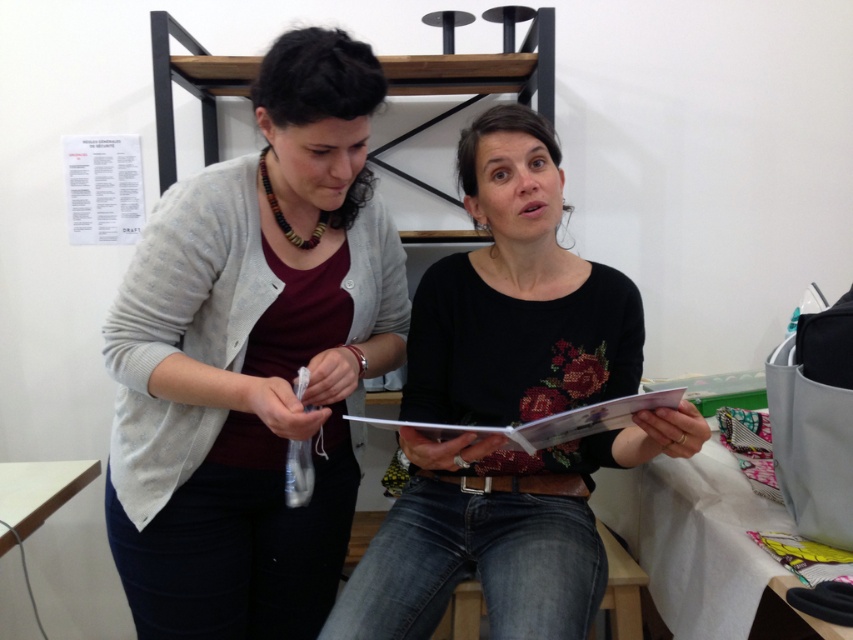
Question: Which of the following is the closest to the observer?

Choices:
 (A) matte gray cardigan at center
 (B) black matte shirt at center

Answer: (A)

Question: Does matte gray cardigan at center have a lesser width compared to black matte shirt at center?

Choices:
 (A) yes
 (B) no

Answer: (A)

Question: Is matte gray cardigan at center thinner than black matte shirt at center?

Choices:
 (A) no
 (B) yes

Answer: (B)

Question: Is matte gray cardigan at center further to camera compared to black matte shirt at center?

Choices:
 (A) no
 (B) yes

Answer: (A)